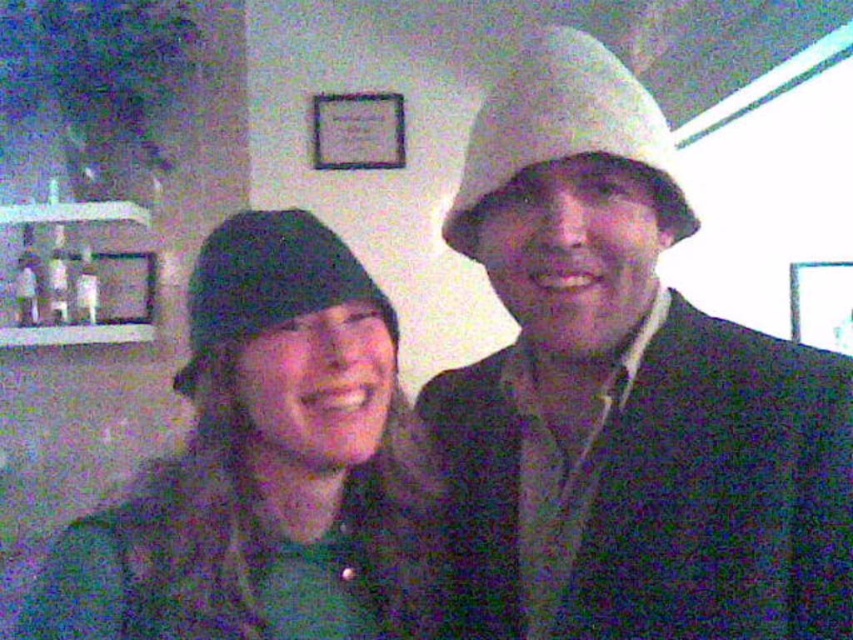
Question: Which point is closer to the camera taking this photo?

Choices:
 (A) (433, 481)
 (B) (666, 147)

Answer: (B)

Question: Estimate the real-world distances between objects in this image. Which object is closer to the black knit beanie at left?

Choices:
 (A) black knit hat at left
 (B) white matte hat at upper right

Answer: (A)

Question: In this image, where is black knit beanie at left located relative to black knit hat at left?

Choices:
 (A) right
 (B) left

Answer: (A)

Question: Which object is the closest to the black knit hat at left?

Choices:
 (A) white matte hat at upper right
 (B) black knit beanie at left

Answer: (B)

Question: Does black knit beanie at left lie in front of white matte hat at upper right?

Choices:
 (A) yes
 (B) no

Answer: (B)

Question: Does black knit beanie at left appear on the left side of black knit hat at left?

Choices:
 (A) yes
 (B) no

Answer: (B)